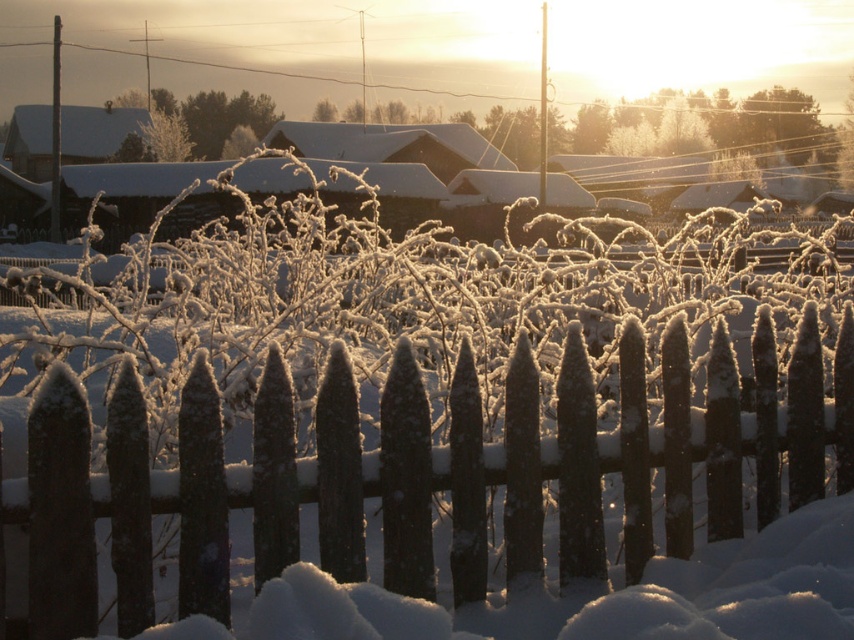
Question: Does smooth dark wood fence at center have a larger size compared to matte brown wooden hut at upper left?

Choices:
 (A) no
 (B) yes

Answer: (A)

Question: Is the position of smooth dark wood fence at center less distant than that of matte brown wooden hut at upper left?

Choices:
 (A) no
 (B) yes

Answer: (B)

Question: Which object is closer to the camera taking this photo?

Choices:
 (A) matte brown wooden hut at upper left
 (B) smooth dark wood fence at center

Answer: (B)

Question: Which point is farther to the camera?

Choices:
 (A) (74, 125)
 (B) (63, 579)

Answer: (A)

Question: Can you confirm if smooth dark wood fence at center is smaller than matte brown wooden hut at upper left?

Choices:
 (A) yes
 (B) no

Answer: (A)